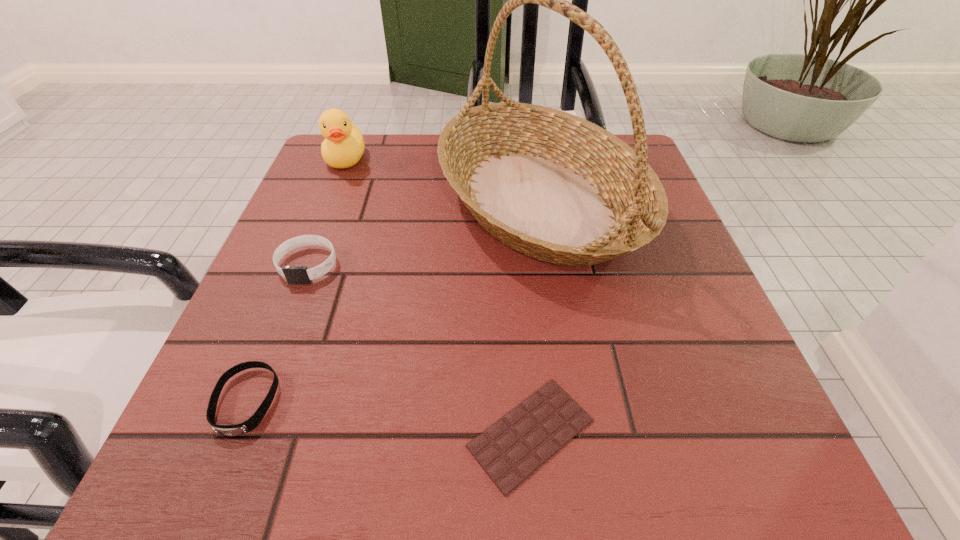
Locate an element on the screen. Image resolution: width=960 pixels, height=540 pixels. basket is located at coordinates point(553,186).

You are a GUI agent. You are given a task and a screenshot of the screen. Output one action in this format:
    pyautogui.click(x=<x>, y=<y>)
    Task: Click on the duck
    This screenshot has width=960, height=540.
    Given the screenshot: What is the action you would take?
    pyautogui.click(x=343, y=146)

You are a GUI agent. You are given a task and a screenshot of the screen. Output one action in this format:
    pyautogui.click(x=<x>, y=<y>)
    Task: Click on the third shortest object
    
    Given the screenshot: What is the action you would take?
    pyautogui.click(x=293, y=274)

Where is `the taller wristband`? the taller wristband is located at coordinates (293, 274).

At what (x,y) coordinates should I click in order to perform the action: click on the nearer wristband. Please return your answer as a coordinate pair (x, y). Looking at the image, I should click on (227, 430).

Image resolution: width=960 pixels, height=540 pixels. In order to click on the second shortest object in this screenshot , I will do `click(227, 430)`.

Find the location of `chocolate bar`. chocolate bar is located at coordinates (510, 450).

I want to click on vacant space located 0.280m at the beak of the duck, so click(x=305, y=261).

What are the coordinates of `vacant space positioned on the outer surface of the farther wristband` in the screenshot? It's located at (257, 395).

Locate an element on the screen. free space located 0.120m on the back of the shortest object is located at coordinates coord(521,315).